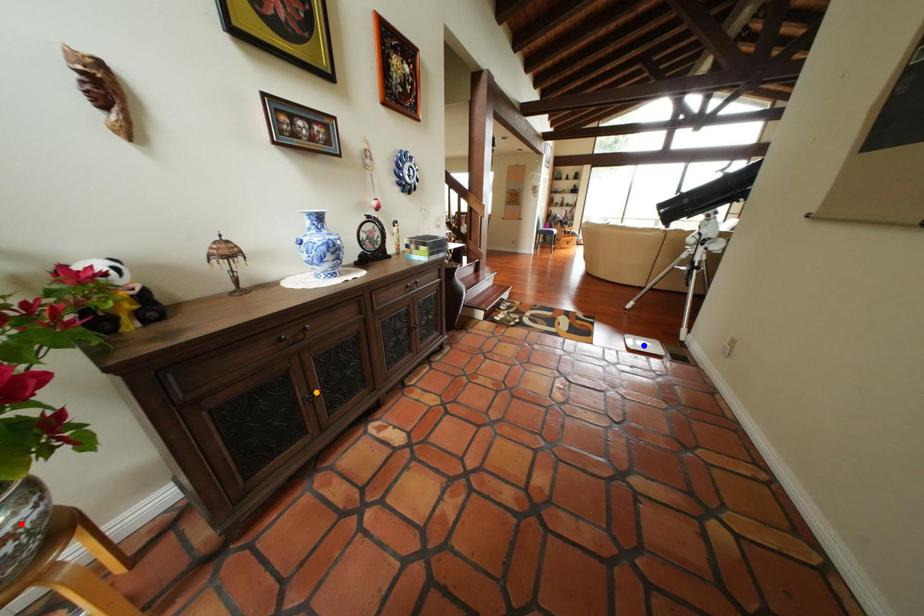
Order these from nearest to farthest:
A) blue point
B) red point
C) orange point

red point
orange point
blue point